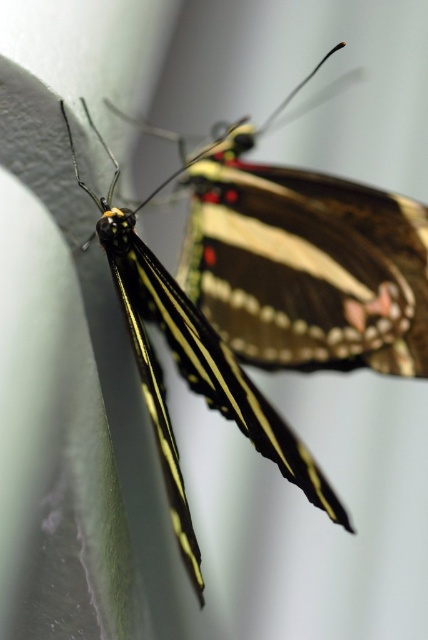
You are holding a camera and want to take a closeup photo of the shiny brown butterfly at upper center. The camera requires the subject to be exactly 1 meter away for optimal focus. Can you take the photo without moving the butterfly?

The shiny brown butterfly at upper center is 1.25 meters from the camera, which is 0.25 meters farther than the required 1 meter. To take the photo without moving the butterfly, you would need to adjust your camera settings or move closer to reduce the distance.

You are standing in front of a wall where two butterflies are resting. You notice a shiny brown butterfly at upper center and another object. Based on their positions, can you determine which one is closer to the point at coordinates [306,262]?

The shiny brown butterfly at upper center is located at point [306,262], so it is exactly at that coordinate and therefore the closest to it.

You are standing at a certain distance from a point marked as point (312, 205) where two butterflies are perched. Can you estimate whether you are closer than 6 feet to this point?

Point (312, 205) and viewer are 5.13 feet apart, so yes, you are closer than 6 feet to this point.